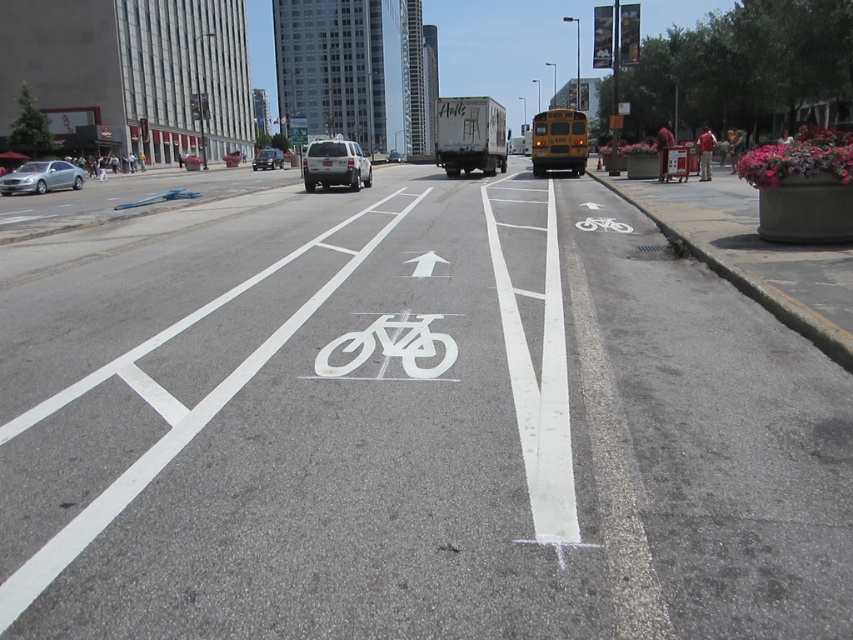
Between point (308, 180) and point (180, 157), which one is positioned in front?

Point (308, 180) is more forward.

Does silver metallic truck at center have a lesser width compared to metallic silver sedan at center?

Correct, silver metallic truck at center's width is less than metallic silver sedan at center's.

Does point (309, 179) lie behind point (199, 163)?

No, it is in front of (199, 163).

Image resolution: width=853 pixels, height=640 pixels. Find the location of `silver metallic truck at center`. silver metallic truck at center is located at coordinates (335, 164).

What do you see at coordinates (558, 141) in the screenshot? The height and width of the screenshot is (640, 853). I see `yellow matte school bus at center` at bounding box center [558, 141].

You are a GUI agent. You are given a task and a screenshot of the screen. Output one action in this format:
    pyautogui.click(x=<x>, y=<y>)
    Task: Click on the yellow matte school bus at center
    The height and width of the screenshot is (640, 853).
    Given the screenshot: What is the action you would take?
    pyautogui.click(x=558, y=141)

Is point (558, 140) closer to viewer compared to point (50, 189)?

Yes, point (558, 140) is in front of point (50, 189).

Locate an element on the screen. yellow matte school bus at center is located at coordinates (558, 141).

Who is more distant from viewer, (566, 115) or (257, 161)?

Point (257, 161)

Is yellow matte school bus at center smaller than silver metallic suv at center?

No.

Find the location of a particular element. yellow matte school bus at center is located at coordinates (558, 141).